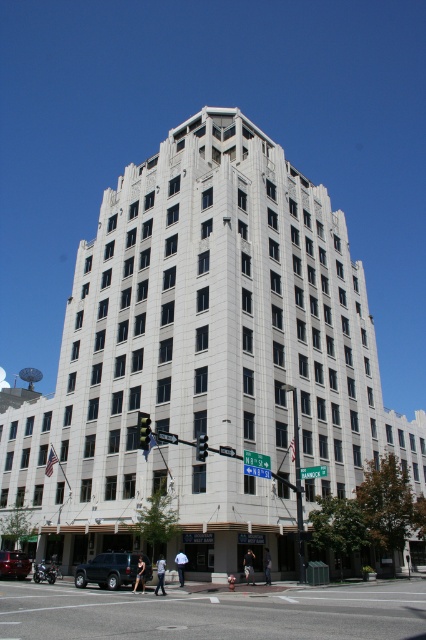
Question: Which point is farther to the camera?

Choices:
 (A) (149, 570)
 (B) (8, 556)

Answer: (B)

Question: Does asphalt road at lower center have a lesser width compared to shiny silver sedan at lower left?

Choices:
 (A) no
 (B) yes

Answer: (A)

Question: Does asphalt road at lower center appear over shiny silver sedan at lower left?

Choices:
 (A) no
 (B) yes

Answer: (B)

Question: Which object appears closest to the camera in this image?

Choices:
 (A) shiny silver sedan at lower left
 (B) asphalt road at lower center

Answer: (B)

Question: Which object is the closest to the black matte suv at lower left?

Choices:
 (A) shiny silver sedan at lower left
 (B) asphalt road at lower center

Answer: (B)

Question: Can you confirm if black matte suv at lower left is thinner than shiny silver sedan at lower left?

Choices:
 (A) no
 (B) yes

Answer: (A)